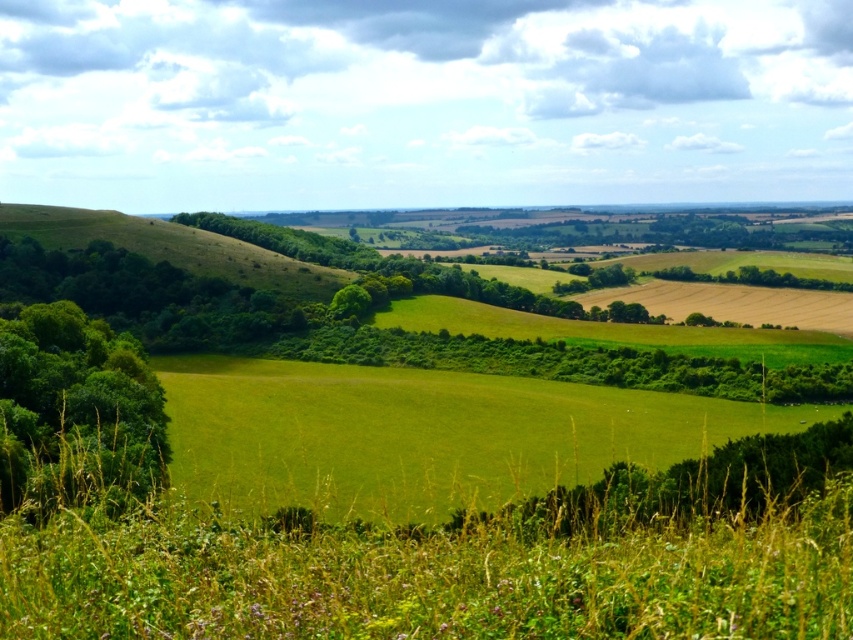
You are standing at the point labeled as point (422, 435) in the image. What type of terrain are you currently standing on?

The point (422, 435) indicates green grassy field at center, so you are standing on a green grassy field.